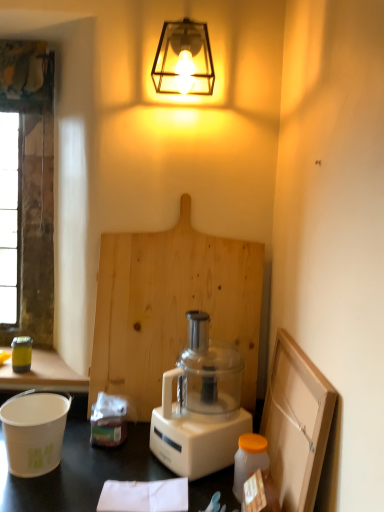
Question: Can you confirm if translucent plastic jar at lower right is thinner than natural wood cutting board at center?

Choices:
 (A) yes
 (B) no

Answer: (B)

Question: Is translucent plastic jar at lower right turned away from natural wood cutting board at center?

Choices:
 (A) yes
 (B) no

Answer: (A)

Question: Can you see translucent plastic jar at lower right touching natural wood cutting board at center?

Choices:
 (A) no
 (B) yes

Answer: (A)

Question: From the image's perspective, is translucent plastic jar at lower right under natural wood cutting board at center?

Choices:
 (A) no
 (B) yes

Answer: (B)

Question: Can you confirm if translucent plastic jar at lower right is smaller than natural wood cutting board at center?

Choices:
 (A) yes
 (B) no

Answer: (A)

Question: Does translucent plastic jar at lower right appear on the left side of natural wood cutting board at center?

Choices:
 (A) yes
 (B) no

Answer: (B)

Question: Is there a large distance between white matte bucket at lower left, the second appliance from the back, and metallic yellow canister at left, the first appliance when ordered from top to bottom?

Choices:
 (A) yes
 (B) no

Answer: (B)

Question: From a real-world perspective, is white matte bucket at lower left, placed as the 1th appliance when sorted from right to left, located higher than metallic yellow canister at left, acting as the first appliance starting from the back?

Choices:
 (A) no
 (B) yes

Answer: (A)

Question: Does white matte bucket at lower left, the second appliance from the back, have a smaller size compared to metallic yellow canister at left, placed as the 2th appliance when sorted from bottom to top?

Choices:
 (A) yes
 (B) no

Answer: (B)

Question: Is white matte bucket at lower left, marked as the first appliance in a bottom-to-top arrangement, to the left of metallic yellow canister at left, acting as the first appliance starting from the back, from the viewer's perspective?

Choices:
 (A) yes
 (B) no

Answer: (B)

Question: Is white matte bucket at lower left, the second appliance from the back, shorter than metallic yellow canister at left, acting as the first appliance starting from the back?

Choices:
 (A) yes
 (B) no

Answer: (B)

Question: Does white matte bucket at lower left, placed as the 1th appliance when sorted from right to left, come in front of metallic yellow canister at left, acting as the first appliance starting from the back?

Choices:
 (A) yes
 (B) no

Answer: (A)

Question: From the image's perspective, is natural wood cutting board at center located beneath metallic cage at upper center?

Choices:
 (A) no
 (B) yes

Answer: (B)